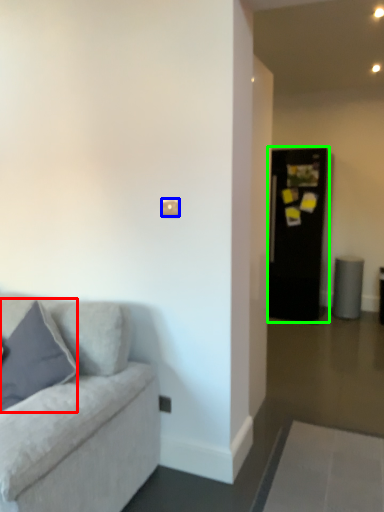
Question: Considering the real-world distances, which object is farthest from pillow (highlighted by a red box)? light switch (highlighted by a blue box) or glass door (highlighted by a green box)?

Choices:
 (A) light switch
 (B) glass door

Answer: (B)